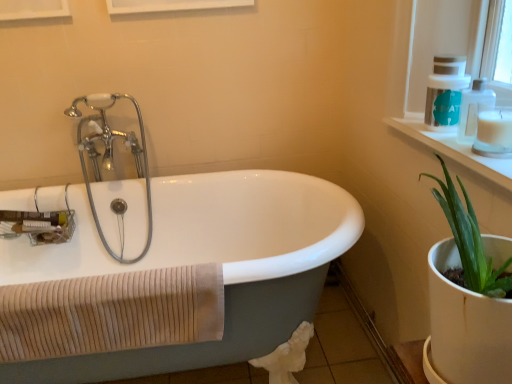
Question: Is the depth of white plastic soap dispenser at upper right, acting as the 2th soap dispenser starting from the front, less than that of white glossy bathtub at center?

Choices:
 (A) no
 (B) yes

Answer: (A)

Question: Is white plastic soap dispenser at upper right, the 1th soap dispenser viewed from the back, bigger than white glossy bathtub at center?

Choices:
 (A) yes
 (B) no

Answer: (B)

Question: Can you confirm if white plastic soap dispenser at upper right, acting as the 2th soap dispenser starting from the front, is smaller than white glossy bathtub at center?

Choices:
 (A) no
 (B) yes

Answer: (B)

Question: From a real-world perspective, is white plastic soap dispenser at upper right, the 1th soap dispenser viewed from the back, located beneath white glossy bathtub at center?

Choices:
 (A) no
 (B) yes

Answer: (A)

Question: Is white plastic soap dispenser at upper right, acting as the 2th soap dispenser starting from the front, wider than white glossy bathtub at center?

Choices:
 (A) yes
 (B) no

Answer: (B)

Question: Considering their positions, is white plastic soap dispenser at upper right, the 1th soap dispenser viewed from the back, located in front of or behind white matte candle at upper right?

Choices:
 (A) behind
 (B) front

Answer: (A)

Question: Is white plastic soap dispenser at upper right, the 1th soap dispenser viewed from the back, wider or thinner than white matte candle at upper right?

Choices:
 (A) thin
 (B) wide

Answer: (B)

Question: Considering the positions of white plastic soap dispenser at upper right, the 1th soap dispenser viewed from the back, and white matte candle at upper right in the image, is white plastic soap dispenser at upper right, the 1th soap dispenser viewed from the back, taller or shorter than white matte candle at upper right?

Choices:
 (A) tall
 (B) short

Answer: (A)

Question: Does point (458, 72) appear closer or farther from the camera than point (499, 140)?

Choices:
 (A) closer
 (B) farther

Answer: (B)

Question: Does point (408, 56) appear closer or farther from the camera than point (106, 144)?

Choices:
 (A) farther
 (B) closer

Answer: (B)

Question: Considering the positions of white plastic window frame at upper right and chrome/metallic faucet at upper left in the image, is white plastic window frame at upper right taller or shorter than chrome/metallic faucet at upper left?

Choices:
 (A) tall
 (B) short

Answer: (B)

Question: From a real-world perspective, is white plastic window frame at upper right above or below chrome/metallic faucet at upper left?

Choices:
 (A) above
 (B) below

Answer: (A)

Question: Visually, is white plastic window frame at upper right positioned to the left or to the right of chrome/metallic faucet at upper left?

Choices:
 (A) right
 (B) left

Answer: (A)

Question: Is point (231, 175) positioned closer to the camera than point (485, 92)?

Choices:
 (A) farther
 (B) closer

Answer: (A)

Question: Would you say white glossy bathtub at center is to the left or to the right of clear plastic soap dispenser at upper right, acting as the 1th soap dispenser starting from the front, in the picture?

Choices:
 (A) left
 (B) right

Answer: (A)